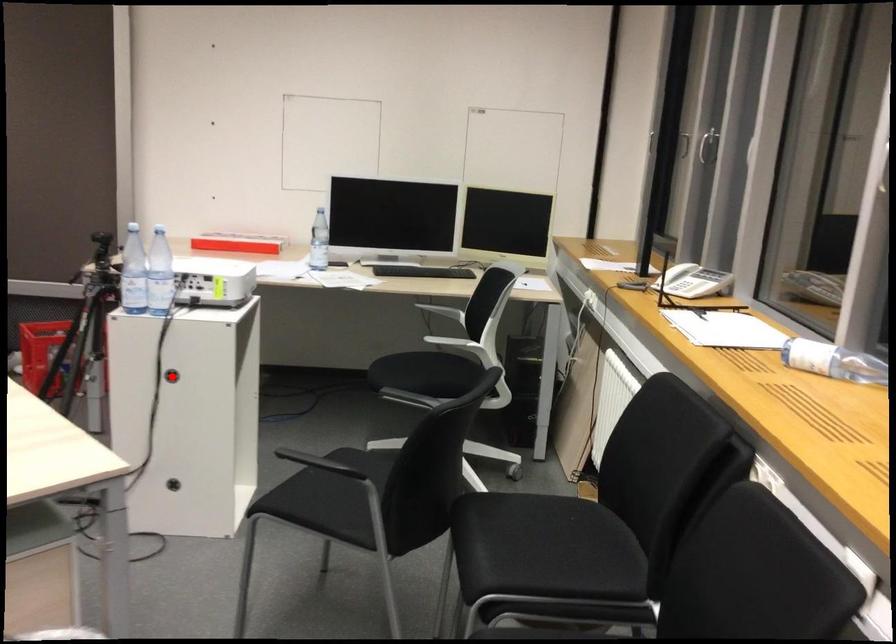
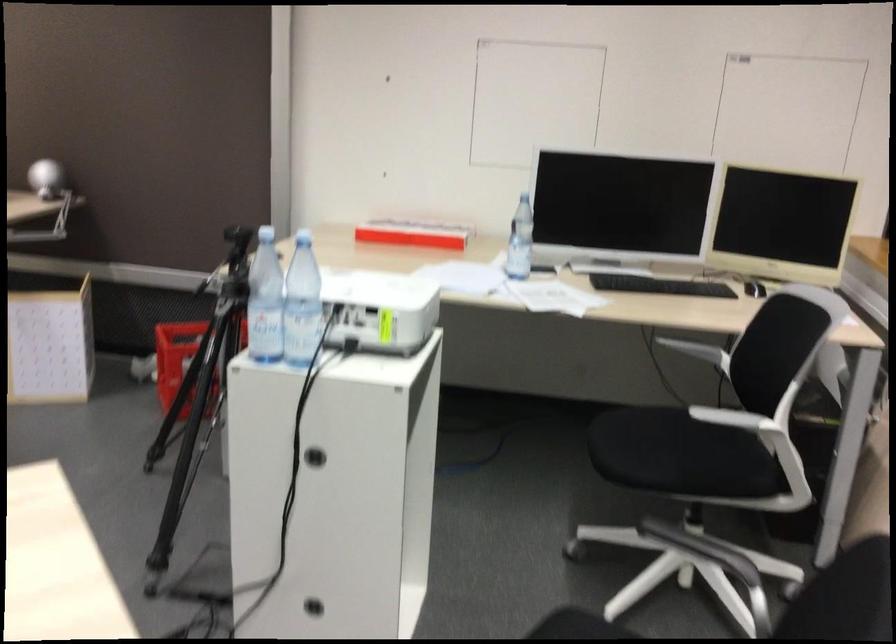
The point at the highlighted location is marked in the first image. Where is the corresponding point in the second image?

(314, 456)